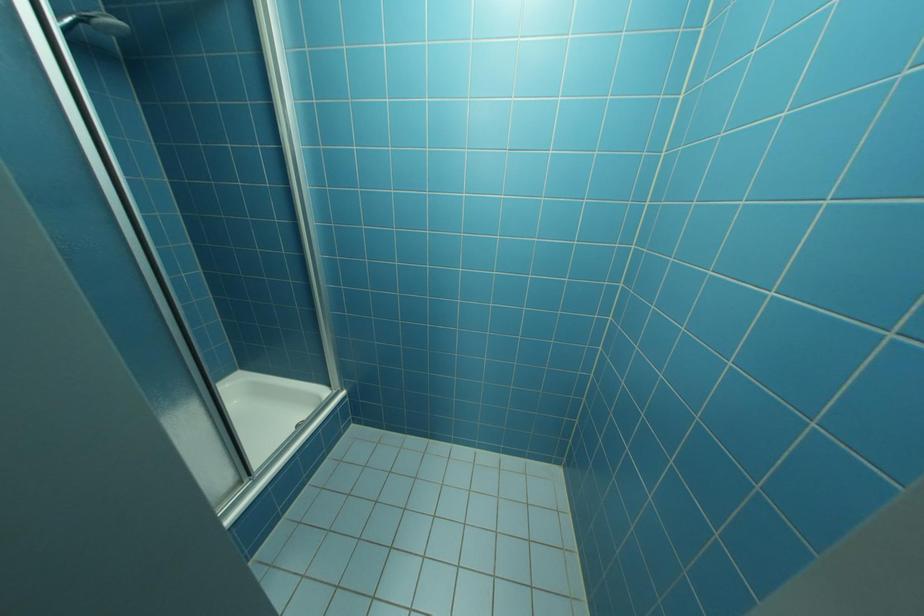
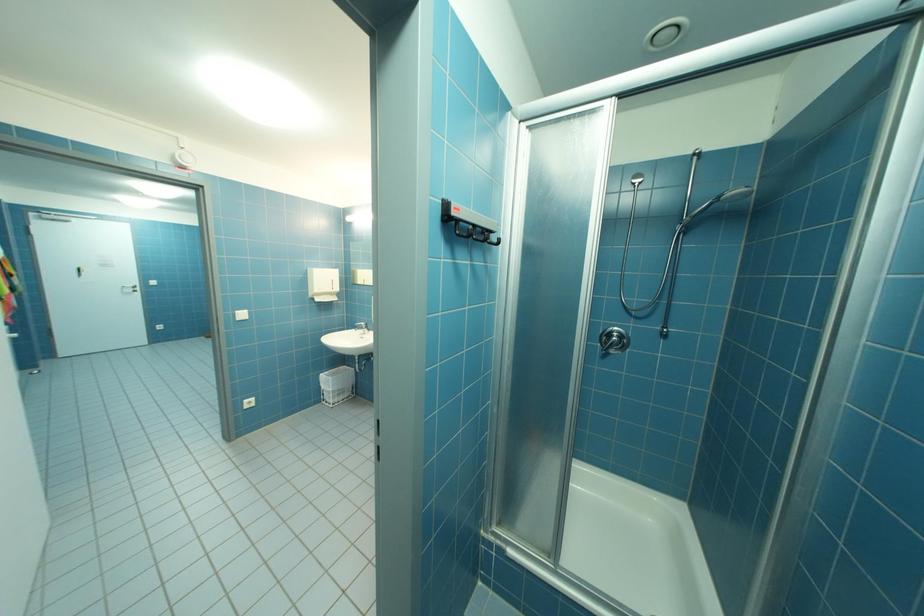
Question: The camera is either moving clockwise (left) or counter-clockwise (right) around the object. The first image is from the beginning of the video and the second image is from the end. Is the camera moving left or right when shooting the video?

Choices:
 (A) Left
 (B) Right

Answer: (B)